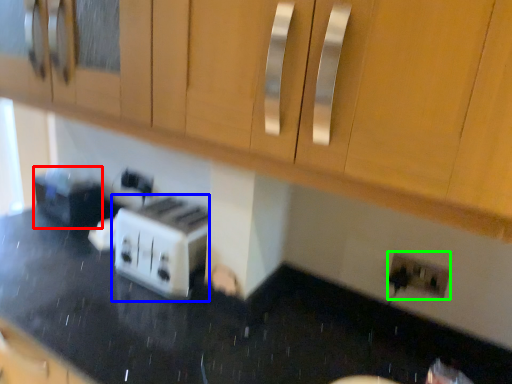
Question: Considering the real-world distances, which object is farthest from appliance (highlighted by a red box)? toaster (highlighted by a blue box) or electric outlet (highlighted by a green box)?

Choices:
 (A) toaster
 (B) electric outlet

Answer: (B)